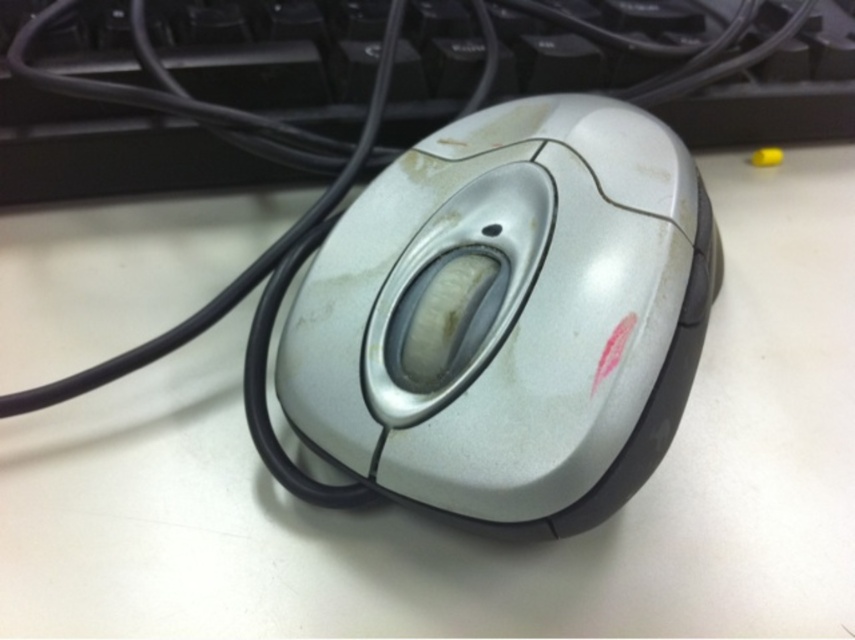
You are organizing your desk and want to move the slightly worn silver mouse at center closer to the black plastic keyboard at upper center. Which direction should you move the mouse to get it closer?

The slightly worn silver mouse at center is currently to the right of the black plastic keyboard at upper center. To move it closer, you should move the mouse to the left.

You are a computer technician assessing the placement of the slightly worn silver mouse at center. According to the coordinate system where the bottom left corner of the desk is the origin point, what are the coordinates of the mouse?

The coordinates of the slightly worn silver mouse at center are at point (514, 316).

You are standing 4 feet away from the desk. The point at coordinates point (x=469, y=166) is part of the computer mouse. Can you reach it without moving closer?

The distance of point (x=469, y=166) from viewer is 3.97 feet, so yes, you can reach it without moving closer since you are already 4 feet away.